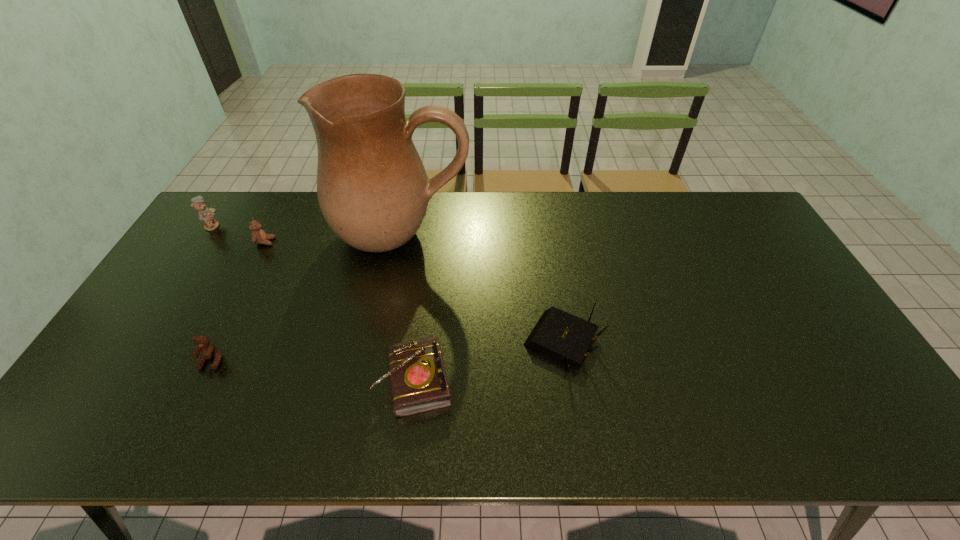
Locate an element on the screen. This screenshot has width=960, height=540. cream pitcher is located at coordinates (373, 190).

The height and width of the screenshot is (540, 960). In order to click on the leftmost teddy bear in this screenshot , I will do `click(205, 214)`.

At what (x,y) coordinates should I click in order to perform the action: click on the tallest teddy bear. Please return your answer as a coordinate pair (x, y). Image resolution: width=960 pixels, height=540 pixels. Looking at the image, I should click on (205, 214).

This screenshot has height=540, width=960. What are the coordinates of `the second farthest teddy bear` in the screenshot? It's located at (258, 235).

Image resolution: width=960 pixels, height=540 pixels. Find the location of `the nearest teddy bear`. the nearest teddy bear is located at coordinates coord(209,351).

Identify the location of the rightmost object. The height and width of the screenshot is (540, 960). (562, 336).

Locate an element on the screen. diary is located at coordinates (418, 380).

Find the location of a particular element. Image resolution: width=960 pixels, height=540 pixels. vacant space situated at the spout of the cream pitcher is located at coordinates (386, 318).

Where is `vacant space located on the front-facing side of the leftmost teddy bear`? vacant space located on the front-facing side of the leftmost teddy bear is located at coordinates (325, 226).

At what (x,y) coordinates should I click in order to perform the action: click on free space located on the front-facing side of the second farthest teddy bear. Please return your answer as a coordinate pair (x, y). The image size is (960, 540). Looking at the image, I should click on (301, 242).